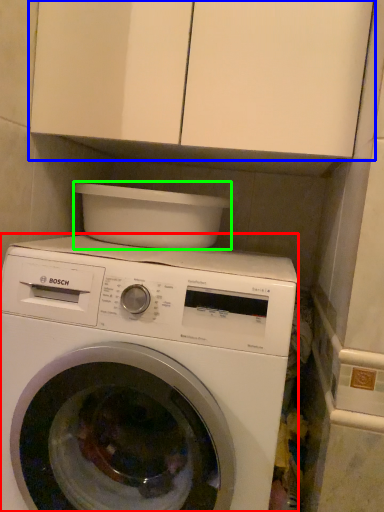
Question: Which is farther away from washing machine (highlighted by a red box)? cabinetry (highlighted by a blue box) or appliance (highlighted by a green box)?

Choices:
 (A) cabinetry
 (B) appliance

Answer: (A)